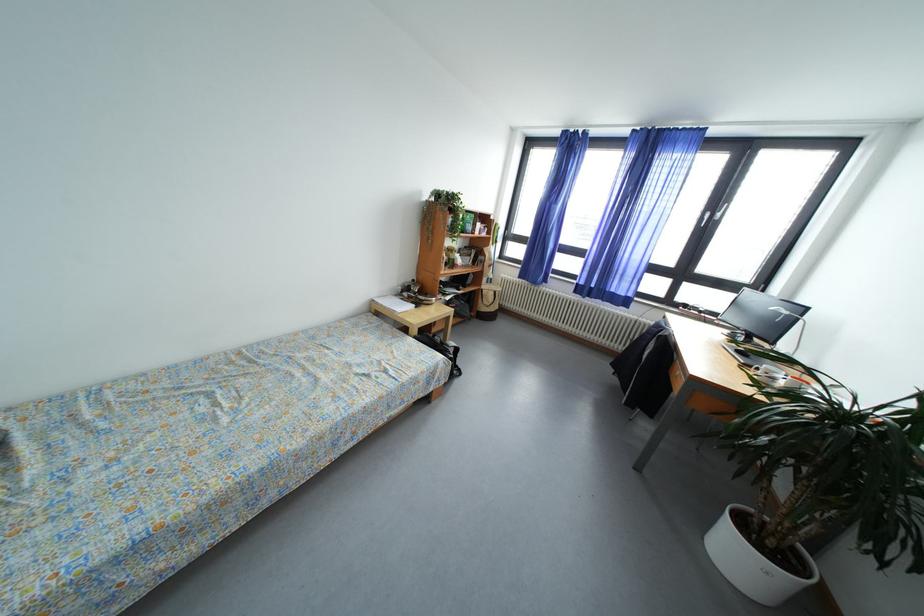
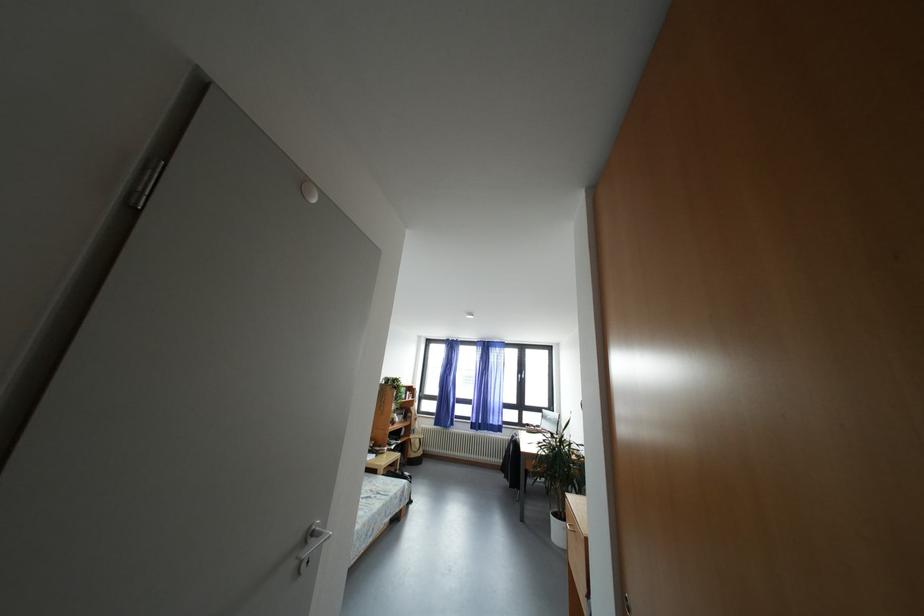
Locate, in the second image, the point that corresponds to [385,367] in the first image.

(378, 496)